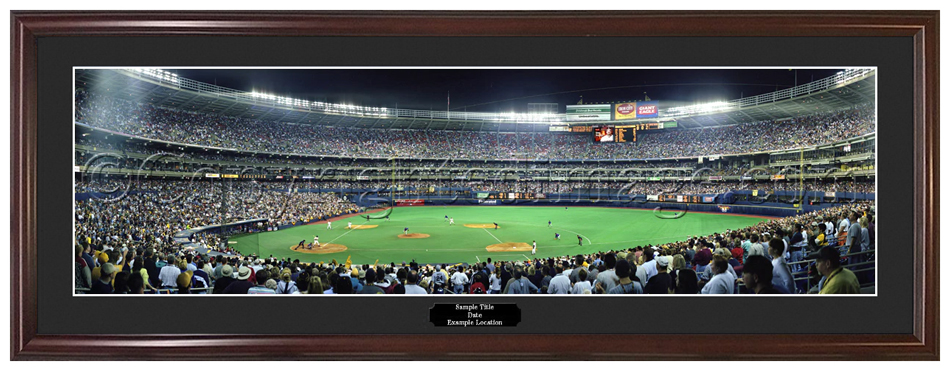
You are a GUI agent. You are given a task and a screenshot of the screen. Output one action in this format:
    pyautogui.click(x=<x>, y=<y>)
    Task: Click on the illuminated screen with image of baseball player
    
    Given the screenshot: What is the action you would take?
    pyautogui.click(x=598, y=132)